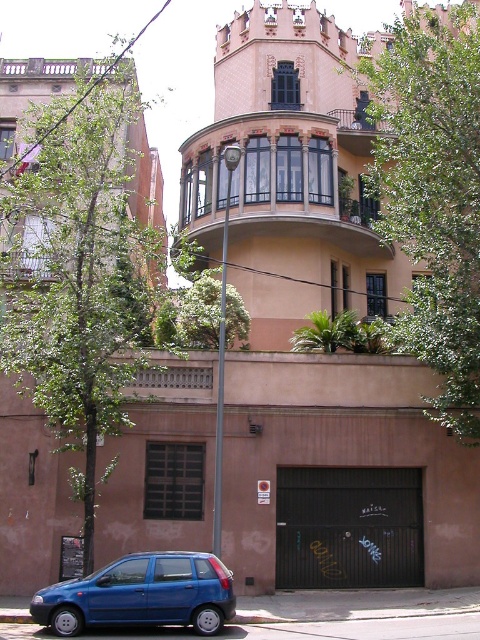
Question: Which object is the farthest from the wooden balcony at upper center?

Choices:
 (A) metallic blue hatchback at lower left
 (B) green leafy tree at upper center
 (C) green leafy tree at upper left
 (D) matte black balcony at center

Answer: (A)

Question: Can you confirm if green leafy tree at upper center is smaller than wooden balcony at upper center?

Choices:
 (A) no
 (B) yes

Answer: (A)

Question: Which point is closer to the camera taking this photo?

Choices:
 (A) (86, 241)
 (B) (67, 634)
 (C) (13, 273)

Answer: (B)

Question: Can you confirm if green leafy tree at upper left is smaller than green leafy tree at upper center?

Choices:
 (A) no
 (B) yes

Answer: (A)

Question: Is green leafy tree at upper left closer to camera compared to green leafy tree at upper center?

Choices:
 (A) yes
 (B) no

Answer: (A)

Question: Which is farther from the glassy wooden balcony at upper center?

Choices:
 (A) metallic blue hatchback at lower left
 (B) green leafy tree at upper center

Answer: (A)